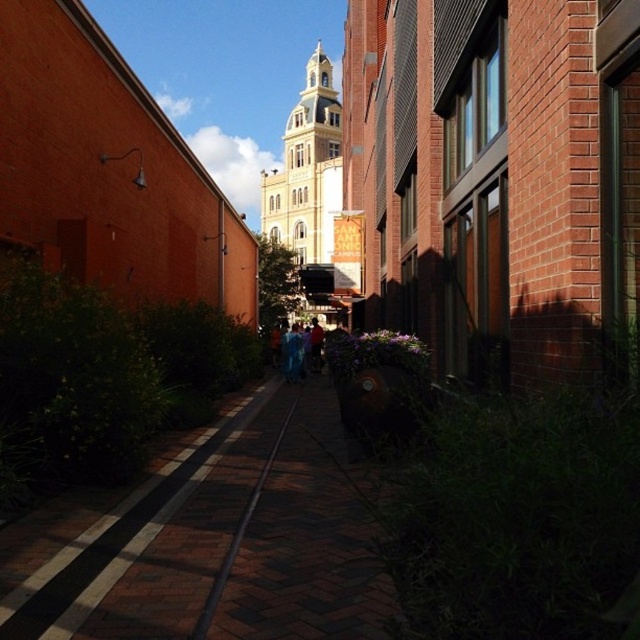
Does brick pavement at center appear on the left side of blue fabric at center?

No, brick pavement at center is not to the left of blue fabric at center.

Which is more to the right, brick pavement at center or blue fabric at center?

From the viewer's perspective, brick pavement at center appears more on the right side.

Locate an element on the screen. This screenshot has height=640, width=640. brick pavement at center is located at coordinates (227, 541).

Can you confirm if yellow matte building at center is taller than black metal train track at center?

Yes.

Does point (296, 144) lie behind point (253, 493)?

Yes, it is.

At what (x,y) coordinates should I click in order to perform the action: click on yellow matte building at center. Please return your answer as a coordinate pair (x, y). The height and width of the screenshot is (640, 640). Looking at the image, I should click on (307, 172).

Is yellow matte building at center smaller than blue fabric at center?

Actually, yellow matte building at center might be larger than blue fabric at center.

Who is positioned more to the left, yellow matte building at center or blue fabric at center?

blue fabric at center is more to the left.

The image size is (640, 640). Describe the element at coordinates (307, 172) in the screenshot. I see `yellow matte building at center` at that location.

Find the location of `yellow matte building at center`. yellow matte building at center is located at coordinates (307, 172).